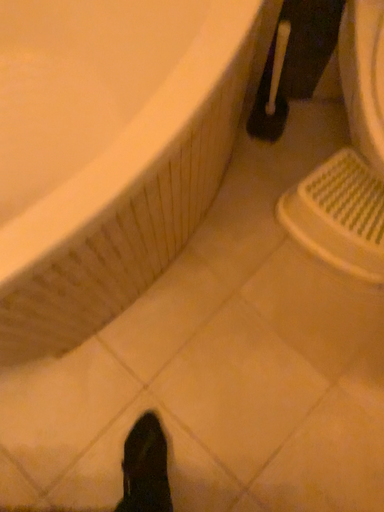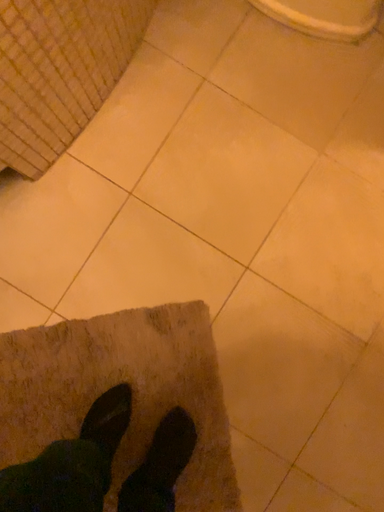
Question: Which way did the camera rotate in the video?

Choices:
 (A) rotated upward
 (B) rotated downward

Answer: (B)